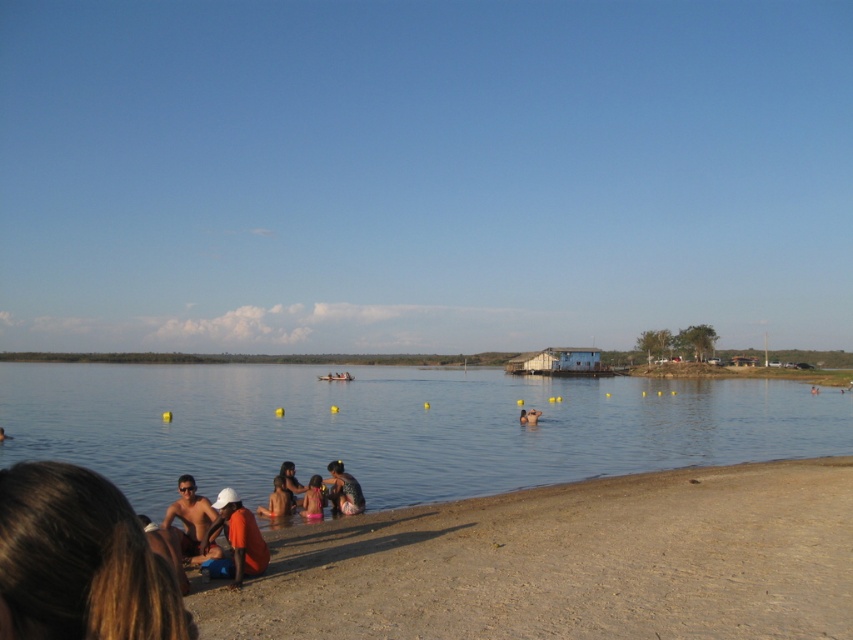
Question: Does pink fabric at lower center appear on the left side of smooth skin person at lower center?

Choices:
 (A) yes
 (B) no

Answer: (A)

Question: Which object is farther from the camera taking this photo?

Choices:
 (A) matte black person at lower left
 (B) orange fabric at lower left
 (C) pink fabric bikini at lower center

Answer: (A)

Question: Estimate the real-world distances between objects in this image. Which object is farther from the smooth skin person at lower center?

Choices:
 (A) shiny orange shirt at lower left
 (B) light brown sandy beach at lower left
 (C) clear water at beach center

Answer: (A)

Question: Is pink fabric bikini at lower center thinner than orange fabric shirt at lower center?

Choices:
 (A) yes
 (B) no

Answer: (B)

Question: Is light brown sandy beach at lower left smaller than clear water at beach center?

Choices:
 (A) no
 (B) yes

Answer: (B)

Question: Which object is farther from the camera taking this photo?

Choices:
 (A) dark brown leather jacket at lower center
 (B) orange fabric at lower left

Answer: (A)